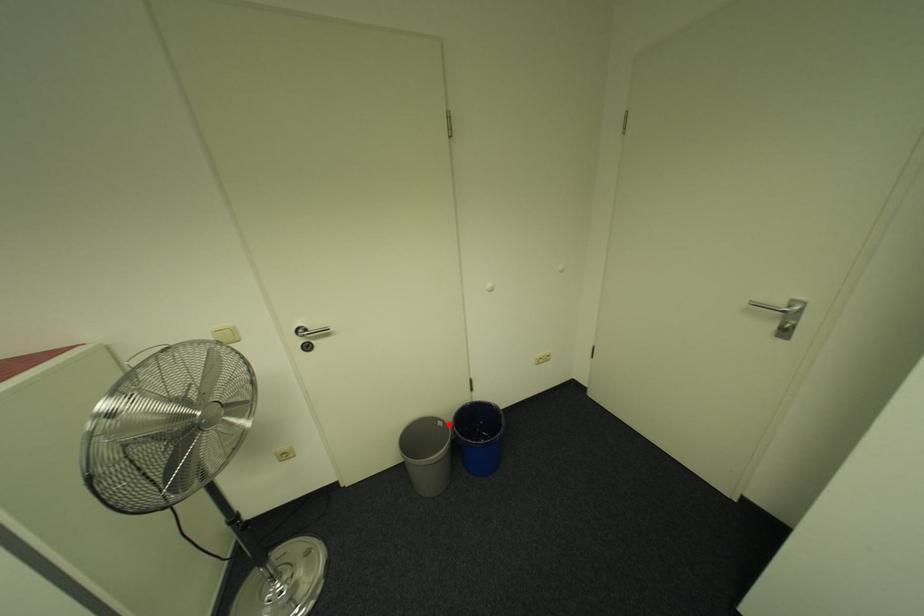
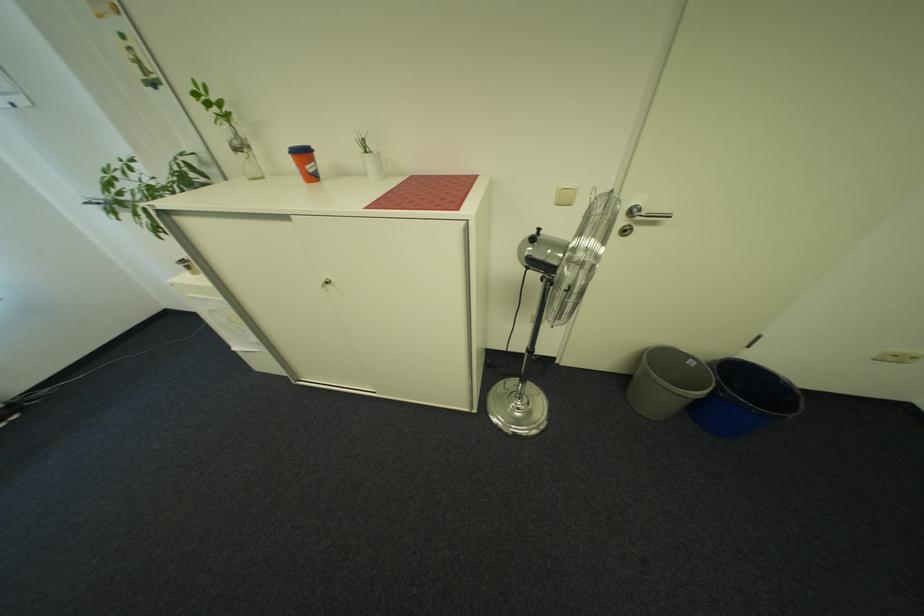
Locate, in the second image, the point that corresponds to the highlighted location in the first image.

(700, 363)